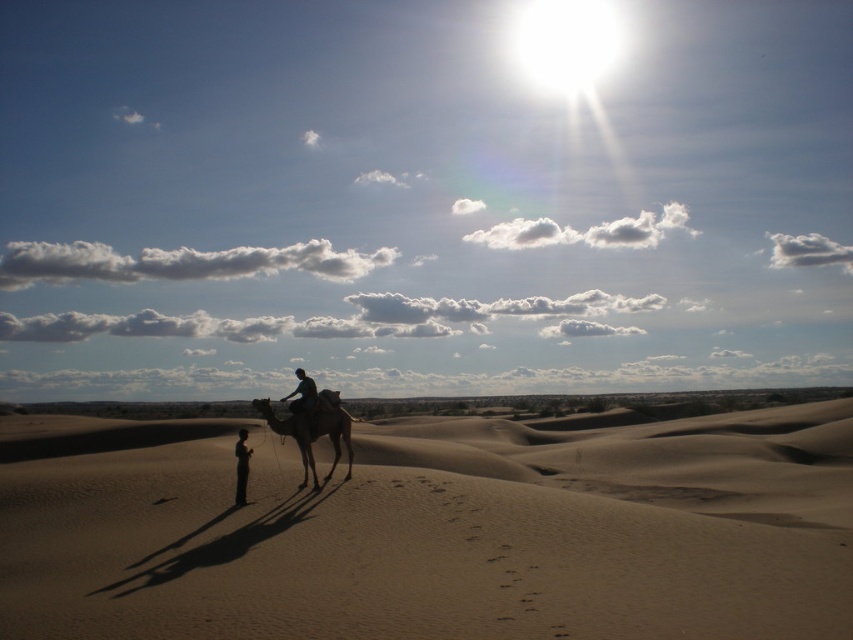
You are standing at the point marked as point (434, 531) in the desert scene. What type of terrain are you currently standing on?

The point (434, 531) is on smooth sand dune at center, so you are standing on a smooth sand dune.

You are a hiker planning to walk from the smooth sand dune at center to the brown textured camel at center. Given that your average walking speed is 1.5 meters per second, how long will it take you to reach the camel?

The distance between the smooth sand dune at center and the brown textured camel at center is 6.81 meters. At a walking speed of 1.5 meters per second, it would take approximately 4.54 seconds to reach the camel.